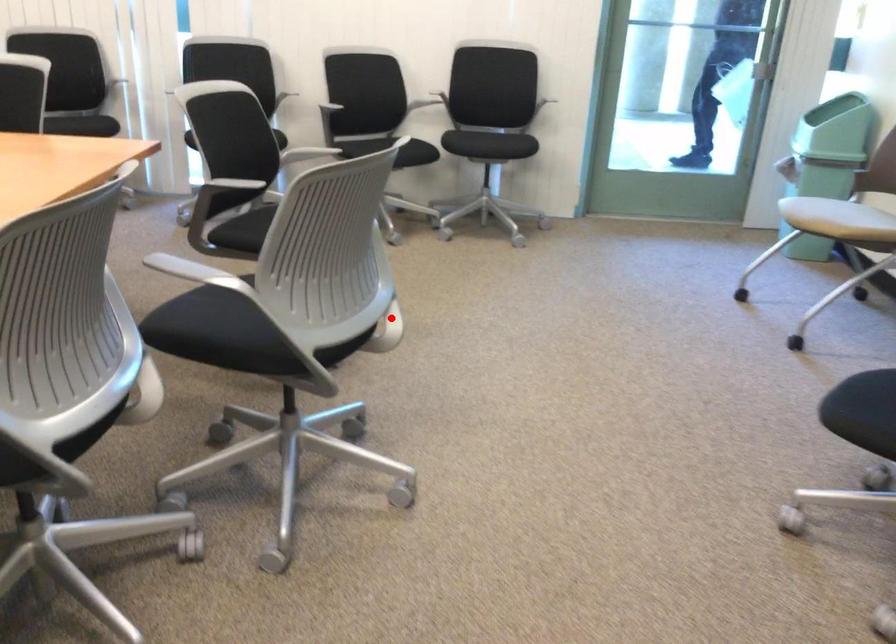
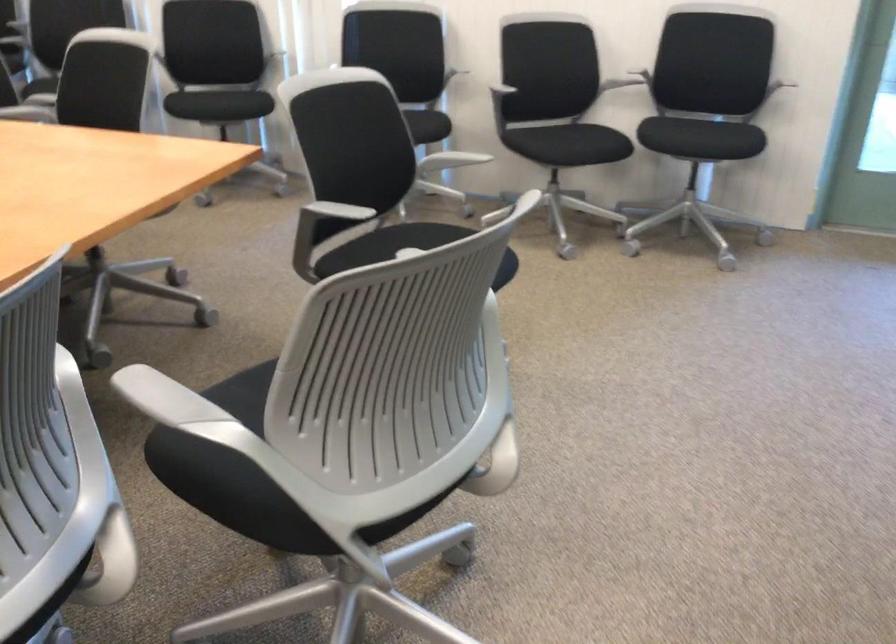
The point at the highlighted location is marked in the first image. Where is the corresponding point in the second image?

(496, 448)